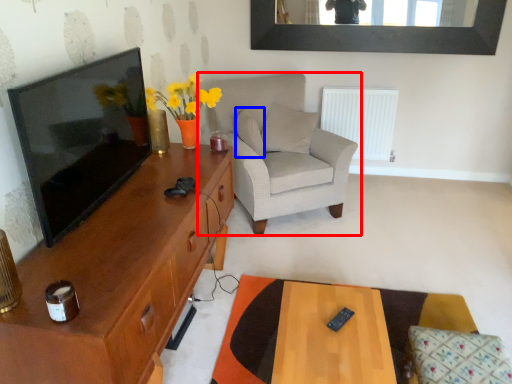
Question: Among these objects, which one is farthest to the camera, chair (highlighted by a red box) or pillow (highlighted by a blue box)?

Choices:
 (A) chair
 (B) pillow

Answer: (B)